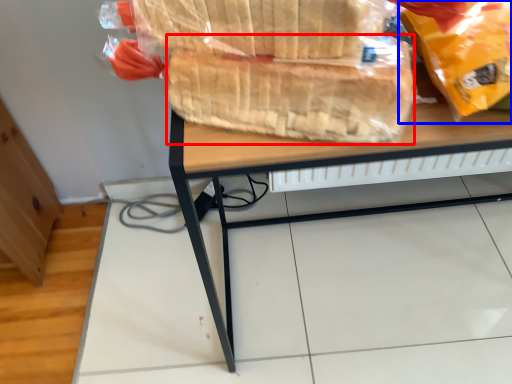
Question: Which object appears closest to the camera in this image, bread (highlighted by a red box) or plastic bag (highlighted by a blue box)?

Choices:
 (A) bread
 (B) plastic bag

Answer: (B)